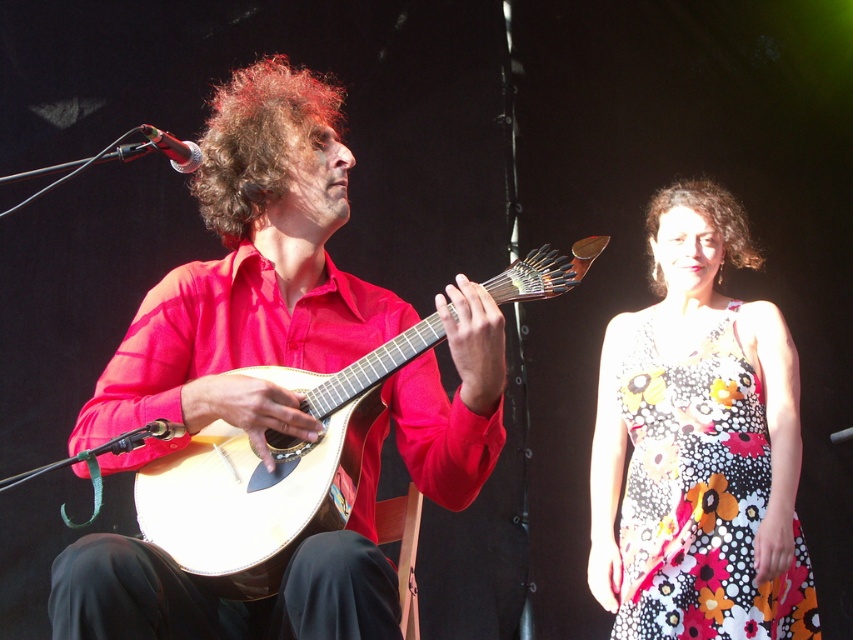
You are a photographer at the back of the venue and want to take a clear photo of the matte red shirt at center and the curly brown hair at center. Which object should you focus on first to ensure both are in focus?

The matte red shirt at center is in front of curly brown hair at center, so you should focus on the matte red shirt at center first to ensure both are in focus.

You are a photographer setting up for a concert. You need to ensure that both the matte red shirt at center and the light wood acoustic guitar at center are clearly visible in your shot. Based on their positions, which object should you focus on first to ensure both are in frame?

The matte red shirt at center is in front of the light wood acoustic guitar at center. To ensure both are in frame, focus on the matte red shirt at center first since it is closer to the camera, and the guitar will naturally be included behind it.

Based on the photo, you are a photographer setting up for a live performance. You need to adjust the camera focus so that both the matte red shirt at center and the curly brown hair at center are in clear view. Given their height difference, which object should you ensure is in focus first?

The matte red shirt at center is much taller than the curly brown hair at center, so you should focus on the matte red shirt at center first to ensure both are in clear view.